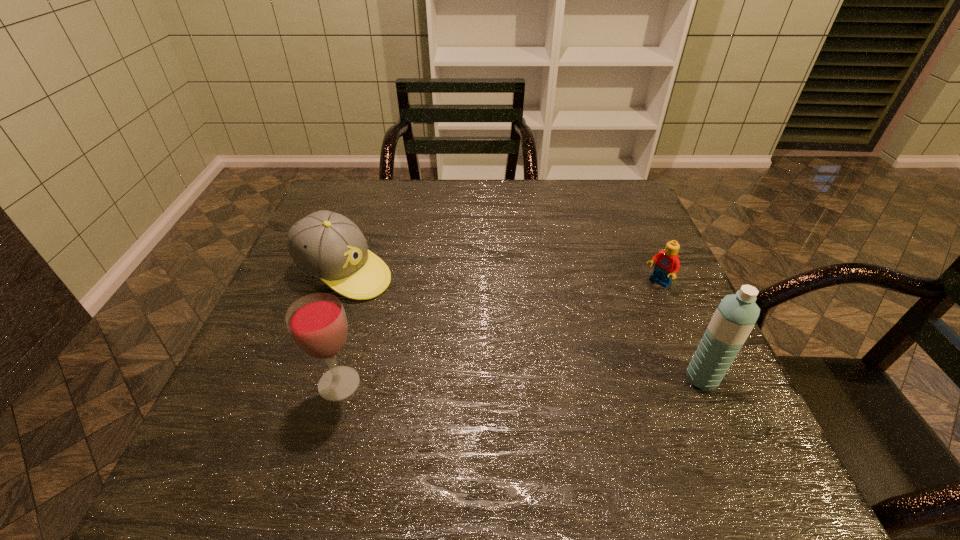
You are a GUI agent. You are given a task and a screenshot of the screen. Output one action in this format:
    pyautogui.click(x=<x>, y=<y>)
    Task: Click on the vacant position located 0.320m on the face of the Lego
    This screenshot has width=960, height=540.
    Given the screenshot: What is the action you would take?
    pyautogui.click(x=553, y=356)

In order to click on vacant space located 0.140m on the face of the Lego in this screenshot , I will do `click(612, 316)`.

Locate an element on the screen. wineglass located at the near edge is located at coordinates (317, 323).

Image resolution: width=960 pixels, height=540 pixels. What are the coordinates of `water bottle at the near edge` in the screenshot? It's located at (736, 315).

You are a GUI agent. You are given a task and a screenshot of the screen. Output one action in this format:
    pyautogui.click(x=<x>, y=<y>)
    Task: Click on the wineglass that is at the left edge
    
    Given the screenshot: What is the action you would take?
    pyautogui.click(x=317, y=323)

Locate an element on the screen. baseball cap located in the left edge section of the desktop is located at coordinates (326, 245).

Identify the location of water bottle present at the right edge. (736, 315).

Where is `Lego that is at the right edge`? Image resolution: width=960 pixels, height=540 pixels. Lego that is at the right edge is located at coordinates (667, 264).

At what (x,y) coordinates should I click in order to perform the action: click on object located in the near left corner section of the desktop. Please return your answer as a coordinate pair (x, y). The image size is (960, 540). Looking at the image, I should click on (317, 323).

Identify the location of object that is at the near right corner. The image size is (960, 540). (736, 315).